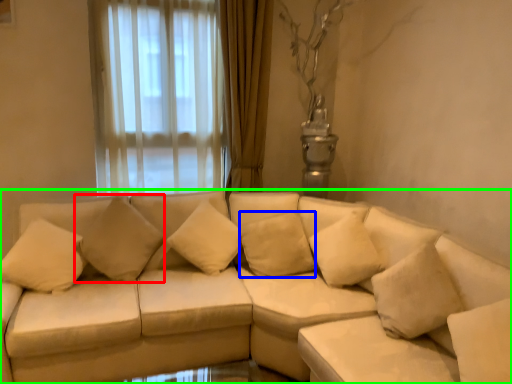
Question: Which is farther away from pillow (highlighted by a red box)? pillow (highlighted by a blue box) or studio couch (highlighted by a green box)?

Choices:
 (A) pillow
 (B) studio couch

Answer: (A)